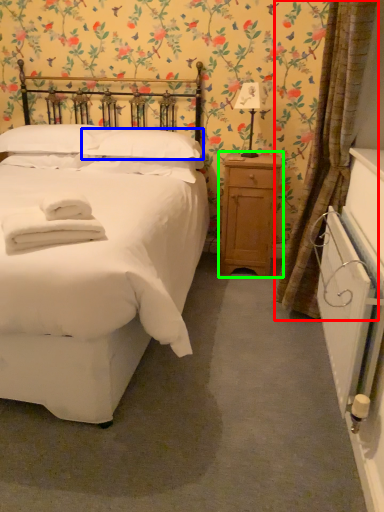
Question: Considering the real-world distances, which object is closest to curtain (highlighted by a red box)? pillow (highlighted by a blue box) or nightstand (highlighted by a green box).

Choices:
 (A) pillow
 (B) nightstand

Answer: (B)